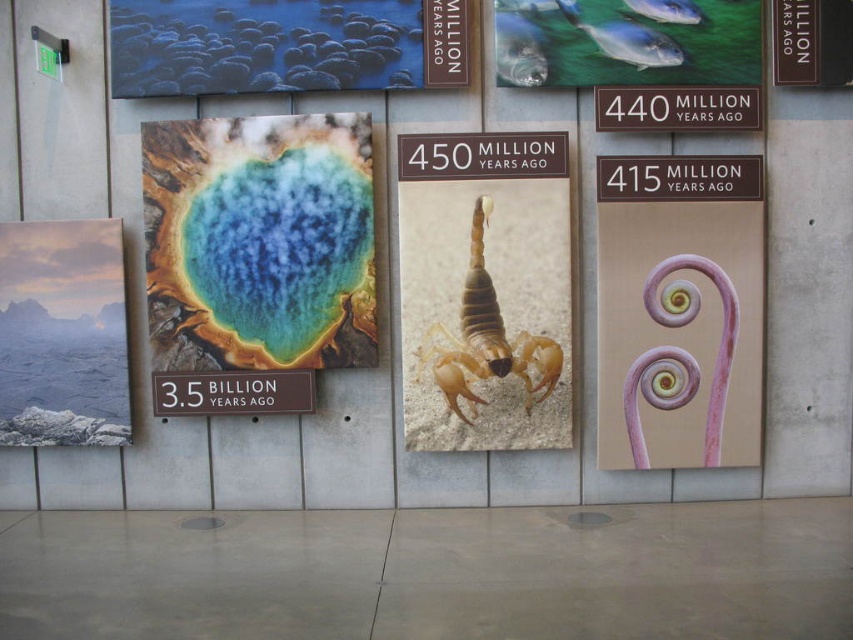
Question: Among these objects, which one is farthest from the camera?

Choices:
 (A) brown/metallic sign at center
 (B) black plastic sign at upper center
 (C) rustic stone landscape at left

Answer: (C)

Question: Is translucent beige scorpion at center thinner than black plastic sign at upper center?

Choices:
 (A) yes
 (B) no

Answer: (A)

Question: Does translucent beige scorpion at center appear over black plastic sign at upper center?

Choices:
 (A) yes
 (B) no

Answer: (B)

Question: Is black plastic sign at upper center below brown/metallic sign at center?

Choices:
 (A) no
 (B) yes

Answer: (A)

Question: Which of the following is the farthest from the observer?

Choices:
 (A) (244, 388)
 (B) (659, 97)
 (C) (529, 51)
 (D) (74, 410)

Answer: (D)

Question: Among these objects, which one is farthest from the camera?

Choices:
 (A) black plastic sign at upper center
 (B) rustic stone landscape at left

Answer: (B)